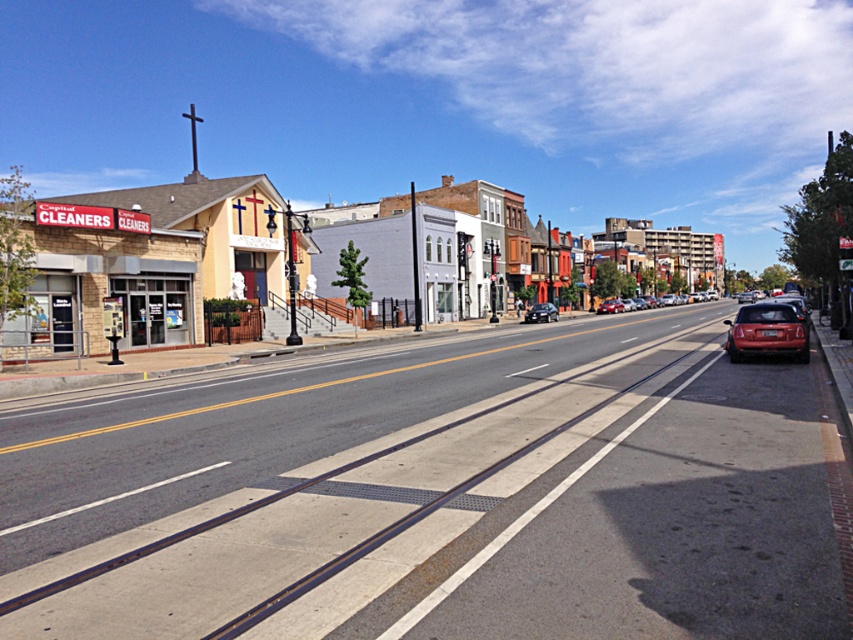
Locate an element on the screen. matte red sedan at center is located at coordinates (665, 300).

Measure the distance from matte red sedan at center to matte red car at center.

matte red sedan at center is 9.95 meters from matte red car at center.

The image size is (853, 640). What do you see at coordinates (665, 300) in the screenshot?
I see `matte red sedan at center` at bounding box center [665, 300].

At what (x,y) coordinates should I click in order to perform the action: click on matte red sedan at center. Please return your answer as a coordinate pair (x, y). The width and height of the screenshot is (853, 640). Looking at the image, I should click on (665, 300).

Find the location of a particular element. This screenshot has width=853, height=640. matte red car at right is located at coordinates (767, 332).

Describe the element at coordinates (767, 332) in the screenshot. I see `matte red car at right` at that location.

Between point (752, 324) and point (544, 316), which one is positioned behind?

Positioned behind is point (544, 316).

The width and height of the screenshot is (853, 640). Find the location of `matte red car at right`. matte red car at right is located at coordinates (767, 332).

What do you see at coordinates (541, 312) in the screenshot? I see `satin black sedan at center` at bounding box center [541, 312].

Identify the location of satin black sedan at center. point(541,312).

At what (x,y) coordinates should I click in order to perform the action: click on satin black sedan at center. Please return your answer as a coordinate pair (x, y). Image resolution: width=853 pixels, height=640 pixels. Looking at the image, I should click on (541, 312).